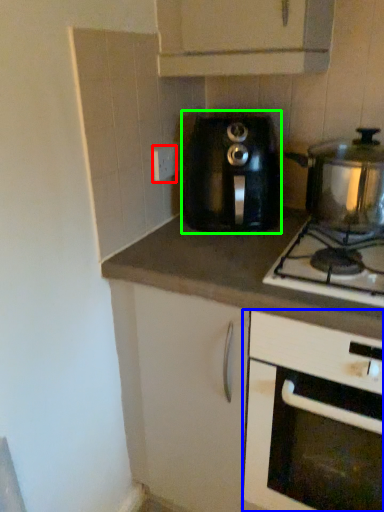
Question: Which is nearer to the electric outlet (highlighted by a red box)? cabinetry (highlighted by a blue box) or kitchen appliance (highlighted by a green box).

Choices:
 (A) cabinetry
 (B) kitchen appliance

Answer: (B)